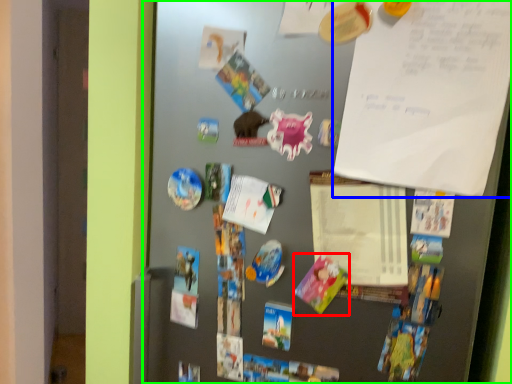
Question: Which is farther away from postcard (highlighted by a red box)? poster (highlighted by a blue box) or fridge (highlighted by a green box)?

Choices:
 (A) poster
 (B) fridge

Answer: (A)